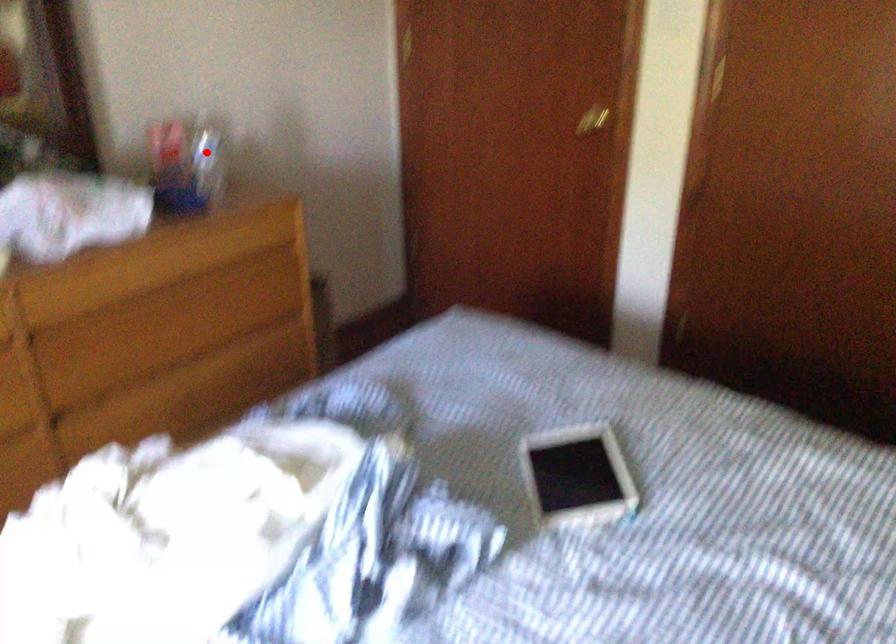
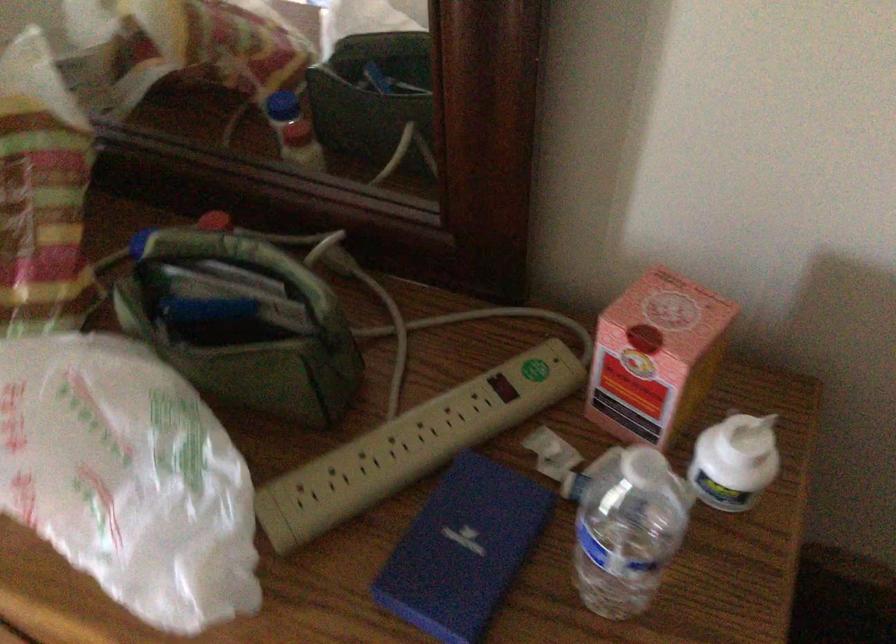
In the second image, find the point that corresponds to the highlighted location in the first image.

(754, 435)